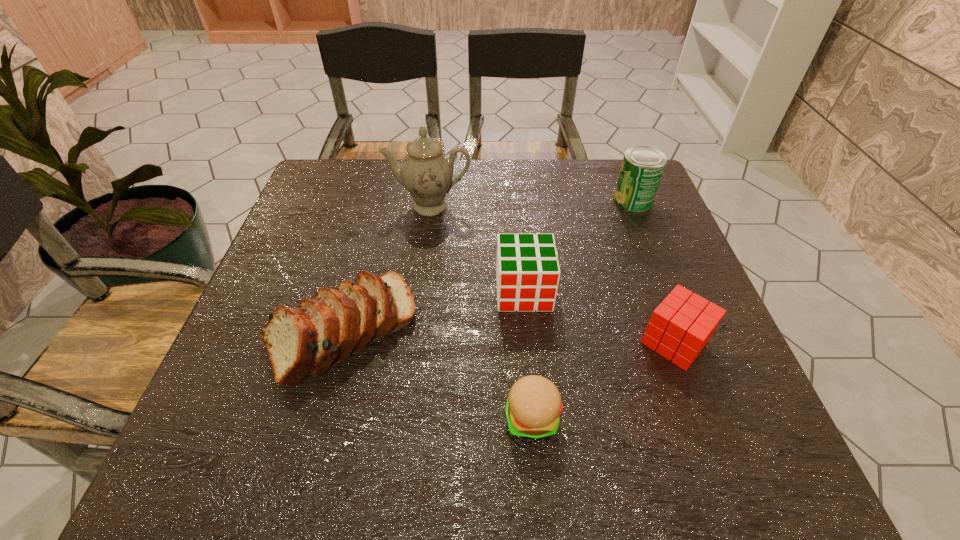
Locate an element on the screen. The width and height of the screenshot is (960, 540). cube positioned at the right edge is located at coordinates click(x=680, y=327).

Where is `object at the far right corner`? object at the far right corner is located at coordinates (642, 167).

Image resolution: width=960 pixels, height=540 pixels. In the image, there is a desktop. Find the location of `vacant space at the far edge`. vacant space at the far edge is located at coordinates (521, 198).

The width and height of the screenshot is (960, 540). Find the location of `vacant area at the near edge`. vacant area at the near edge is located at coordinates (348, 450).

In the image, there is a desktop. What are the coordinates of `vacant space at the left edge` in the screenshot? It's located at (296, 237).

Where is `vacant space at the right edge of the desktop`? The width and height of the screenshot is (960, 540). vacant space at the right edge of the desktop is located at coordinates (634, 287).

In the image, there is a desktop. At what (x,y) coordinates should I click in order to perform the action: click on vacant space at the near left corner. Please return your answer as a coordinate pair (x, y). The image size is (960, 540). Looking at the image, I should click on (231, 436).

Locate an element on the screen. free spot between the farther cube and the can is located at coordinates (x=578, y=246).

Find the location of `free space between the shortest object and the left cube`. free space between the shortest object and the left cube is located at coordinates (528, 354).

This screenshot has width=960, height=540. I want to click on vacant area that lies between the taller cube and the shortest object, so click(x=528, y=354).